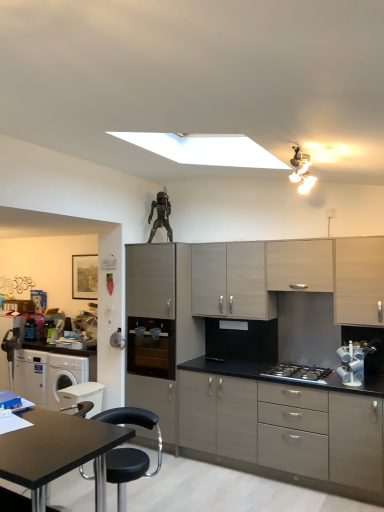
Identify the location of light wood cabinet at upper center, marked as the fourth cabinetry in a left-to-right arrangement. This screenshot has height=512, width=384. (300, 265).

At what (x,y) coordinates should I click in order to perform the action: click on matte gray cabinet at center, which appears as the 1th cabinetry when viewed from the left. Please return your answer as a coordinate pair (x, y). The width and height of the screenshot is (384, 512). Looking at the image, I should click on (160, 328).

This screenshot has height=512, width=384. Find the location of `black glass water dispenser at center`. black glass water dispenser at center is located at coordinates 151,348.

The image size is (384, 512). I want to click on black matte table at lower left, so click(x=57, y=451).

I want to click on light wood cabinet at upper center, the first cabinetry from the right, so click(300, 265).

From a real-world perspective, which is physically above, white glossy cup at right, the first appliance when ordered from right to left, or matte gray cabinet at center, which appears as the 1th cabinetry when viewed from the left?

From a 3D spatial view, white glossy cup at right, the first appliance when ordered from right to left, is above.

Do you think white glossy cup at right, marked as the 1th appliance in a front-to-back arrangement, is within matte gray cabinet at center, which appears as the 1th cabinetry when viewed from the left, or outside of it?

white glossy cup at right, marked as the 1th appliance in a front-to-back arrangement, is located beyond the bounds of matte gray cabinet at center, which appears as the 1th cabinetry when viewed from the left.

Is point (346, 349) positioned after point (172, 312)?

No, it is in front of (172, 312).

From the image's perspective, is white glossy cup at right, marked as the 2th appliance in a bottom-to-top arrangement, beneath matte gray cabinet at center, which appears as the 1th cabinetry when viewed from the left?

No, from the image's perspective, white glossy cup at right, marked as the 2th appliance in a bottom-to-top arrangement, is not below matte gray cabinet at center, which appears as the 1th cabinetry when viewed from the left.

Consider the image. Considering the positions of objects light wood cabinet at center, the second cabinetry viewed from the left, and white glossy cup at right, marked as the 2th appliance in a bottom-to-top arrangement, in the image provided, who is behind, light wood cabinet at center, the second cabinetry viewed from the left, or white glossy cup at right, marked as the 2th appliance in a bottom-to-top arrangement,?

light wood cabinet at center, the second cabinetry viewed from the left, is further away from the camera.

Considering the relative sizes of light wood cabinet at center, the second cabinetry viewed from the left, and white glossy cup at right, acting as the 2th appliance starting from the left, in the image provided, is light wood cabinet at center, the second cabinetry viewed from the left, wider than white glossy cup at right, acting as the 2th appliance starting from the left,?

Yes.

This screenshot has height=512, width=384. In order to click on appliance that is the 1st object located below the light wood cabinet at center, arranged as the 3th cabinetry when viewed from the right (from the image's perspective) in this screenshot , I will do `click(353, 362)`.

Looking at this image, would you say light wood cabinet at center, arranged as the 3th cabinetry when viewed from the right, contains white glossy cup at right, acting as the 2th appliance starting from the left?

No, white glossy cup at right, acting as the 2th appliance starting from the left, is located outside of light wood cabinet at center, arranged as the 3th cabinetry when viewed from the right.

Is white plastic washing machine at lower left, which appears as the first appliance when viewed from the back, bigger or smaller than matte gray cabinet at center, which appears as the 1th cabinetry when viewed from the left?

white plastic washing machine at lower left, which appears as the first appliance when viewed from the back, is smaller than matte gray cabinet at center, which appears as the 1th cabinetry when viewed from the left.

In the scene shown: Is white plastic washing machine at lower left, which is counted as the second appliance, starting from the right, taller or shorter than matte gray cabinet at center, the 4th cabinetry in the right-to-left sequence?

Clearly, white plastic washing machine at lower left, which is counted as the second appliance, starting from the right, is shorter compared to matte gray cabinet at center, the 4th cabinetry in the right-to-left sequence.

Is white plastic washing machine at lower left, which appears as the first appliance when viewed from the back, inside or outside of matte gray cabinet at center, which appears as the 1th cabinetry when viewed from the left?

white plastic washing machine at lower left, which appears as the first appliance when viewed from the back, is not enclosed by matte gray cabinet at center, which appears as the 1th cabinetry when viewed from the left.

Is white plastic washing machine at lower left, which is counted as the second appliance, starting from the right, at the left side of matte gray cabinet at center, which appears as the 1th cabinetry when viewed from the left?

Correct, you'll find white plastic washing machine at lower left, which is counted as the second appliance, starting from the right, to the left of matte gray cabinet at center, which appears as the 1th cabinetry when viewed from the left.

From the image's perspective, would you say matte gray cabinet at center, the 4th cabinetry in the right-to-left sequence, is shown under white glossy cup at right, marked as the 1th appliance in a front-to-back arrangement?

Yes, from the image's perspective, matte gray cabinet at center, the 4th cabinetry in the right-to-left sequence, is below white glossy cup at right, marked as the 1th appliance in a front-to-back arrangement.

Which of these two, matte gray cabinet at center, which appears as the 1th cabinetry when viewed from the left, or white glossy cup at right, the first appliance when ordered from right to left, stands shorter?

white glossy cup at right, the first appliance when ordered from right to left, is shorter.

Is matte gray cabinet at center, the 4th cabinetry in the right-to-left sequence, inside or outside of white glossy cup at right, which is the first appliance in top-to-bottom order?

matte gray cabinet at center, the 4th cabinetry in the right-to-left sequence, is outside white glossy cup at right, which is the first appliance in top-to-bottom order.

Which object is wider, matte gray cabinets at lower right, the second cabinetry viewed from the right, or matte gray cabinet at center, the 4th cabinetry in the right-to-left sequence?

With larger width is matte gray cabinet at center, the 4th cabinetry in the right-to-left sequence.

Does matte gray cabinets at lower right, the second cabinetry viewed from the right, have a larger size compared to matte gray cabinet at center, the 4th cabinetry in the right-to-left sequence?

Yes.

Where is `the 3rd cabinetry in front of the matte gray cabinet at center, the 4th cabinetry in the right-to-left sequence`? the 3rd cabinetry in front of the matte gray cabinet at center, the 4th cabinetry in the right-to-left sequence is located at coordinates (282, 428).

In the image, is matte gray cabinets at lower right, arranged as the third cabinetry when viewed from the left, on the left side or the right side of matte gray cabinet at center, the 4th cabinetry in the right-to-left sequence?

matte gray cabinets at lower right, arranged as the third cabinetry when viewed from the left, is to the right of matte gray cabinet at center, the 4th cabinetry in the right-to-left sequence.

Is light wood cabinet at center, arranged as the 3th cabinetry when viewed from the right, positioned beyond the bounds of matte gray cabinets at lower right, the second cabinetry viewed from the right?

light wood cabinet at center, arranged as the 3th cabinetry when viewed from the right, lies outside matte gray cabinets at lower right, the second cabinetry viewed from the right,'s area.

From a real-world perspective, which is physically below, light wood cabinet at center, arranged as the 3th cabinetry when viewed from the right, or matte gray cabinets at lower right, the second cabinetry viewed from the right?

matte gray cabinets at lower right, the second cabinetry viewed from the right.

Identify the location of the 2nd cabinetry behind the matte gray cabinets at lower right, arranged as the third cabinetry when viewed from the left. (231, 281).

Is light wood cabinet at upper center, the first cabinetry from the right, aimed at white glossy cup at right, positioned as the second appliance in back-to-front order?

No, light wood cabinet at upper center, the first cabinetry from the right, is not aimed at white glossy cup at right, positioned as the second appliance in back-to-front order.

From the image's perspective, would you say light wood cabinet at upper center, marked as the fourth cabinetry in a left-to-right arrangement, is shown under white glossy cup at right, marked as the 1th appliance in a front-to-back arrangement?

No, from the image's perspective, light wood cabinet at upper center, marked as the fourth cabinetry in a left-to-right arrangement, is not beneath white glossy cup at right, marked as the 1th appliance in a front-to-back arrangement.

Does point (298, 266) appear closer or farther from the camera than point (346, 358)?

Point (298, 266) is positioned farther from the camera compared to point (346, 358).

Looking at this image, which object is positioned more to the right, light wood cabinet at upper center, marked as the fourth cabinetry in a left-to-right arrangement, or white glossy cup at right, marked as the 2th appliance in a bottom-to-top arrangement?

From the viewer's perspective, white glossy cup at right, marked as the 2th appliance in a bottom-to-top arrangement, appears more on the right side.

Where is `appliance above the matte gray cabinet at center, the 4th cabinetry in the right-to-left sequence (from the image's perspective)`? Image resolution: width=384 pixels, height=512 pixels. appliance above the matte gray cabinet at center, the 4th cabinetry in the right-to-left sequence (from the image's perspective) is located at coordinates (353, 362).

The width and height of the screenshot is (384, 512). Find the location of `the 1st appliance located beneath the light wood cabinet at center, arranged as the 3th cabinetry when viewed from the right (from a real-world perspective)`. the 1st appliance located beneath the light wood cabinet at center, arranged as the 3th cabinetry when viewed from the right (from a real-world perspective) is located at coordinates (353, 362).

Which object lies further to the anchor point light wood cabinet at upper center, marked as the fourth cabinetry in a left-to-right arrangement, black matte table at lower left or light wood cabinet at center, arranged as the 3th cabinetry when viewed from the right?

Based on the image, black matte table at lower left appears to be further to light wood cabinet at upper center, marked as the fourth cabinetry in a left-to-right arrangement.

Considering their positions, is stainless steel gas stove at center positioned closer to white plastic washing machine at lower left, the 1th appliance viewed from the left, than black matte table at lower left?

Among the two, black matte table at lower left is located nearer to white plastic washing machine at lower left, the 1th appliance viewed from the left.

Which object lies nearer to the anchor point white plastic washing machine at lower left, the second appliance positioned from the top, matte gray cabinet at center, which appears as the 1th cabinetry when viewed from the left, or black glass water dispenser at center?

Based on the image, black glass water dispenser at center appears to be nearer to white plastic washing machine at lower left, the second appliance positioned from the top.

Looking at the image, which one is located further to black glass water dispenser at center, white plastic washing machine at lower left, the second appliance positioned from the top, or white glossy cup at right, which is the first appliance in top-to-bottom order?

The object further to black glass water dispenser at center is white glossy cup at right, which is the first appliance in top-to-bottom order.

When comparing their distances from black glass water dispenser at center, does matte gray cabinets at lower right, the second cabinetry viewed from the right, or white glossy cup at right, marked as the 1th appliance in a front-to-back arrangement, seem further?

white glossy cup at right, marked as the 1th appliance in a front-to-back arrangement.

From the image, which object appears to be farther from light wood cabinet at upper center, marked as the fourth cabinetry in a left-to-right arrangement, white glossy cup at right, acting as the 2th appliance starting from the left, or matte gray cabinet at center, which appears as the 1th cabinetry when viewed from the left?

matte gray cabinet at center, which appears as the 1th cabinetry when viewed from the left, is positioned further to the anchor light wood cabinet at upper center, marked as the fourth cabinetry in a left-to-right arrangement.

Based on their spatial positions, is black matte table at lower left or matte gray cabinet at center, which appears as the 1th cabinetry when viewed from the left, further from stainless steel gas stove at center?

black matte table at lower left is positioned further to the anchor stainless steel gas stove at center.

Which object lies nearer to the anchor point black leather chair at lower left, white glossy cup at right, the first appliance when ordered from right to left, or black matte table at lower left?

black matte table at lower left lies closer to black leather chair at lower left than the other object.

Find the location of a particular element. Image resolution: width=384 pixels, height=512 pixels. cabinetry between white plastic washing machine at lower left, arranged as the 1th appliance when ordered from the bottom, and black glass water dispenser at center is located at coordinates 160,328.

In order to click on chair located between black matte table at lower left and white glossy cup at right, acting as the 2th appliance starting from the left, in the left-right direction in this screenshot , I will do `click(129, 450)`.

You are a GUI agent. You are given a task and a screenshot of the screen. Output one action in this format:
    pyautogui.click(x=<x>, y=<y>)
    Task: Click on the gas stove located between matte gray cabinet at center, which appears as the 1th cabinetry when viewed from the left, and white glossy cup at right, acting as the 2th appliance starting from the left, in the left-right direction
    The height and width of the screenshot is (512, 384).
    Given the screenshot: What is the action you would take?
    pyautogui.click(x=299, y=373)

The height and width of the screenshot is (512, 384). In order to click on kitchen appliance situated between white plastic washing machine at lower left, arranged as the 1th appliance when ordered from the bottom, and light wood cabinet at center, arranged as the 3th cabinetry when viewed from the right, from left to right in this screenshot , I will do `click(151, 348)`.